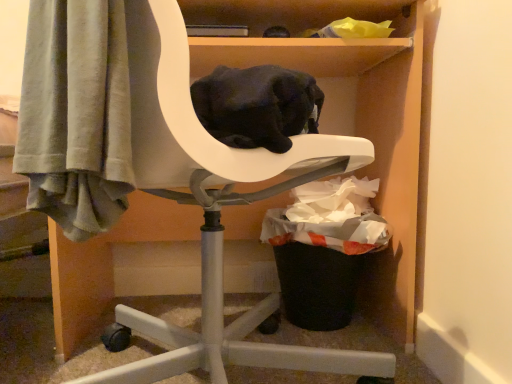
Where is `white plastic chair at center`? The width and height of the screenshot is (512, 384). white plastic chair at center is located at coordinates (292, 137).

What do you see at coordinates (292, 137) in the screenshot? I see `white plastic chair at center` at bounding box center [292, 137].

What is the approximate width of white plastic chair at center?

45.08 centimeters.

What do you see at coordinates (324, 249) in the screenshot? Image resolution: width=512 pixels, height=384 pixels. I see `black plastic trash can at lower right` at bounding box center [324, 249].

In order to face black plastic trash can at lower right, should I rotate leftwards or rightwards?

To align with it, rotate right about 8.817°.

Identify the location of black plastic trash can at lower right. The width and height of the screenshot is (512, 384). (324, 249).

This screenshot has height=384, width=512. Find the location of `white plastic chair at center`. white plastic chair at center is located at coordinates (292, 137).

Between white plastic chair at center and black plastic trash can at lower right, which one appears on the left side from the viewer's perspective?

From the viewer's perspective, white plastic chair at center appears more on the left side.

Which object is further away from the camera, white plastic chair at center or black plastic trash can at lower right?

black plastic trash can at lower right is more distant.

Which is further, (122, 314) or (364, 224)?

Point (364, 224)

From the image's perspective, which is above, white plastic chair at center or black plastic trash can at lower right?

white plastic chair at center is shown above in the image.

From a real-world perspective, who is located higher, white plastic chair at center or black plastic trash can at lower right?

From a 3D spatial view, white plastic chair at center is above.

Does white plastic chair at center have a greater width compared to black plastic trash can at lower right?

Indeed, white plastic chair at center has a greater width compared to black plastic trash can at lower right.

Is white plastic chair at center taller than black plastic trash can at lower right?

Indeed, white plastic chair at center has a greater height compared to black plastic trash can at lower right.

Can you confirm if white plastic chair at center is bigger than black plastic trash can at lower right?

Indeed, white plastic chair at center has a larger size compared to black plastic trash can at lower right.

Do you think white plastic chair at center is within black plastic trash can at lower right, or outside of it?

white plastic chair at center cannot be found inside black plastic trash can at lower right.

Is white plastic chair at center with black plastic trash can at lower right?

No, white plastic chair at center is not making contact with black plastic trash can at lower right.

From the picture: Is black plastic trash can at lower right at the back of white plastic chair at center?

Yes, white plastic chair at center is positioned with its back facing black plastic trash can at lower right.

You are a GUI agent. You are given a task and a screenshot of the screen. Output one action in this format:
    pyautogui.click(x=<x>, y=<y>)
    Task: Click on the furniture that is in front of the black plastic trash can at lower right
    This screenshot has width=512, height=384.
    Given the screenshot: What is the action you would take?
    pyautogui.click(x=292, y=137)

Would you say black plastic trash can at lower right is to the left or to the right of white plastic chair at center in the picture?

black plastic trash can at lower right is to the right of white plastic chair at center.

Is black plastic trash can at lower right behind white plastic chair at center?

Yes.

Is point (307, 287) closer to camera compared to point (156, 286)?

Yes, it is in front of point (156, 286).

From the image's perspective, is black plastic trash can at lower right above or below white plastic chair at center?

Based on their image positions, black plastic trash can at lower right is located beneath white plastic chair at center.

From a real-world perspective, is black plastic trash can at lower right positioned under white plastic chair at center based on gravity?

Yes, from a real-world perspective, black plastic trash can at lower right is under white plastic chair at center.

Looking at their sizes, would you say black plastic trash can at lower right is wider or thinner than white plastic chair at center?

In the image, black plastic trash can at lower right appears to be more narrow than white plastic chair at center.

Who is taller, black plastic trash can at lower right or white plastic chair at center?

white plastic chair at center is taller.

Does black plastic trash can at lower right have a larger size compared to white plastic chair at center?

No, black plastic trash can at lower right is not bigger than white plastic chair at center.

Is white plastic chair at center located within black plastic trash can at lower right?

Definitely not — white plastic chair at center is not inside black plastic trash can at lower right.

Would you say black plastic trash can at lower right is a long distance from white plastic chair at center?

No, black plastic trash can at lower right is not far away from white plastic chair at center.

Could you tell me if black plastic trash can at lower right is facing white plastic chair at center?

Yes, black plastic trash can at lower right is oriented towards white plastic chair at center.

Can you tell me how much black plastic trash can at lower right and white plastic chair at center differ in facing direction?

There is a 0.00109-degree angle between the facing directions of black plastic trash can at lower right and white plastic chair at center.

At what (x,y) coordinates should I click in order to perform the action: click on furniture above the black plastic trash can at lower right (from a real-world perspective). Please return your answer as a coordinate pair (x, y). Looking at the image, I should click on (292, 137).

I want to click on garbage below the white plastic chair at center (from a real-world perspective), so click(x=324, y=249).

The width and height of the screenshot is (512, 384). Identify the location of garbage below the white plastic chair at center (from the image's perspective). (324, 249).